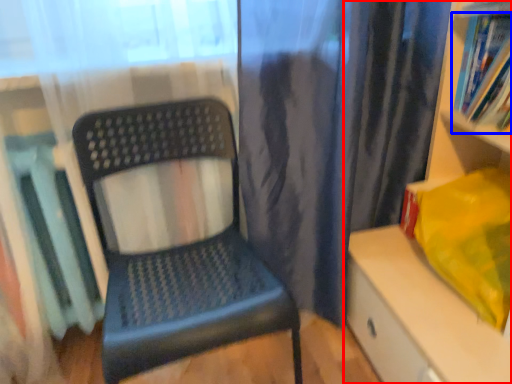
Question: Among these objects, which one is nearest to the camera, shelf (highlighted by a red box) or book (highlighted by a blue box)?

Choices:
 (A) shelf
 (B) book

Answer: (A)